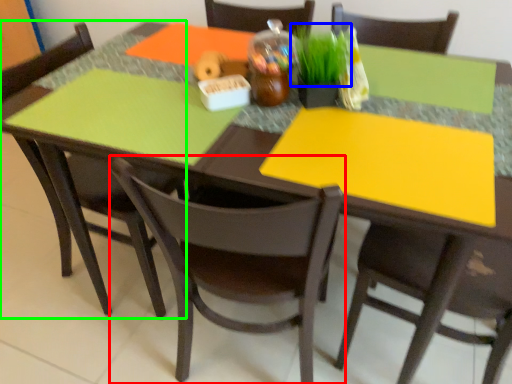
Question: Which object is the closest to the chair (highlighted by a red box)? Choose among these: grass (highlighted by a blue box) or chair (highlighted by a green box).

Choices:
 (A) grass
 (B) chair

Answer: (B)